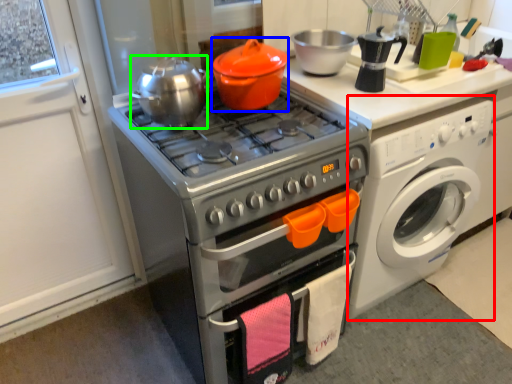
Question: Which object is positioned farthest from washing machine (highlighted by a red box)? Select from crock pot (highlighted by a blue box) and tea pot (highlighted by a green box).

Choices:
 (A) crock pot
 (B) tea pot

Answer: (B)